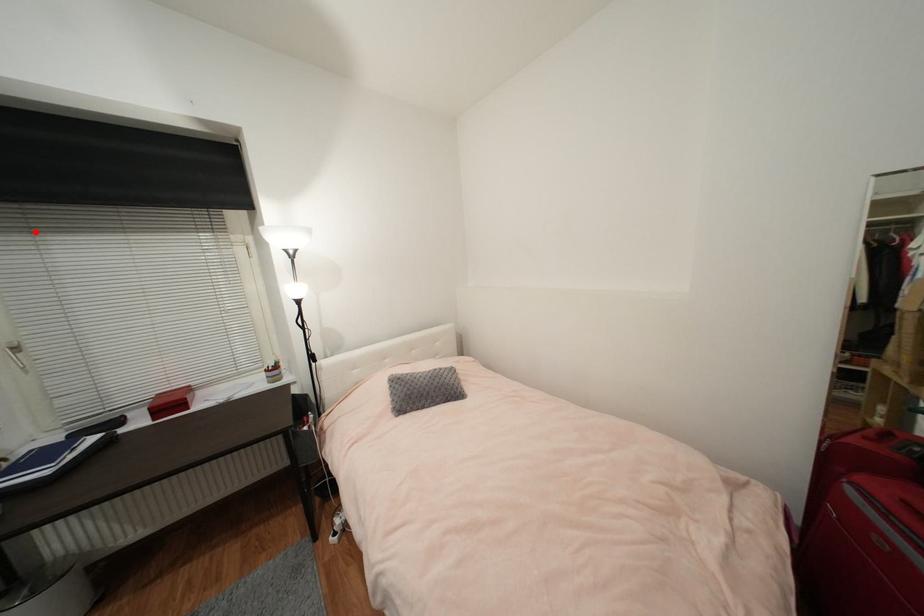
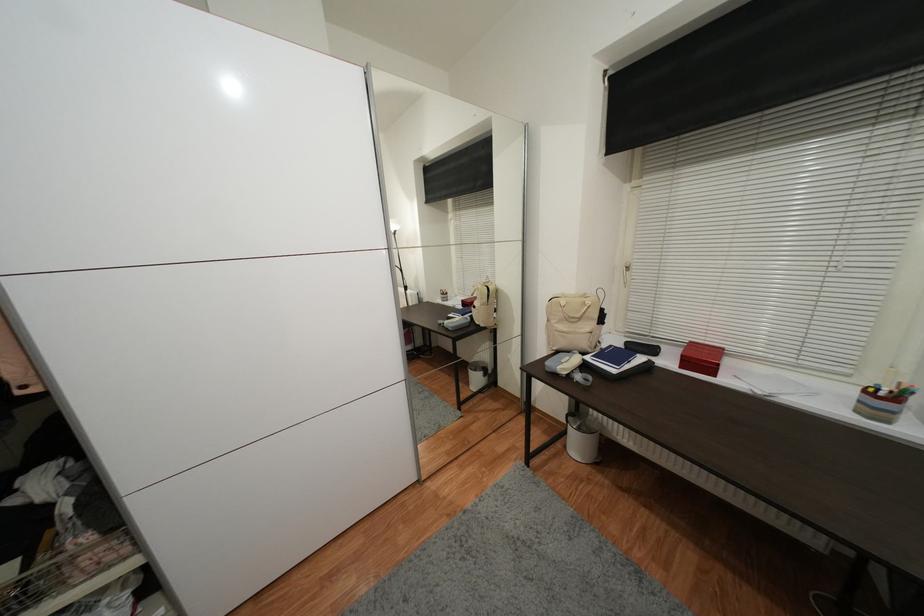
Locate, in the second image, the point that corresponds to the highlighted location in the first image.

(678, 167)